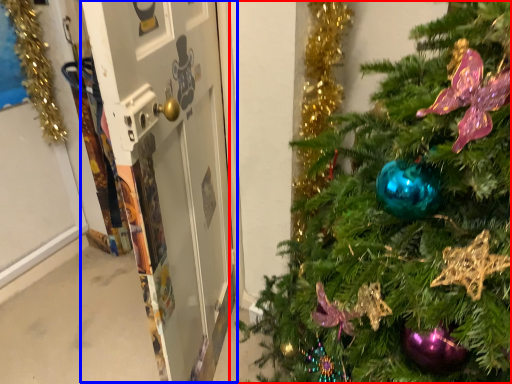
Question: Which object appears farthest to the camera in this image, christmas tree (highlighted by a red box) or screen door (highlighted by a blue box)?

Choices:
 (A) christmas tree
 (B) screen door

Answer: (B)